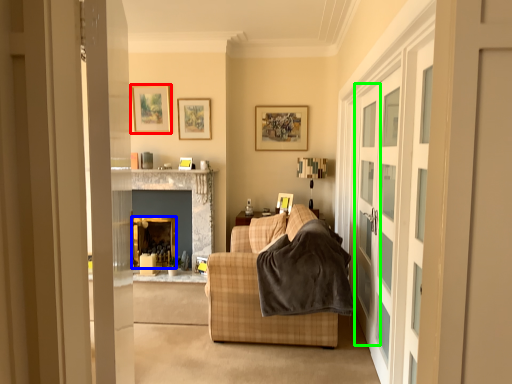
Question: Which is nearer to the picture frame (highlighted by a red box)? fireplace (highlighted by a blue box) or screen door (highlighted by a green box).

Choices:
 (A) fireplace
 (B) screen door

Answer: (A)